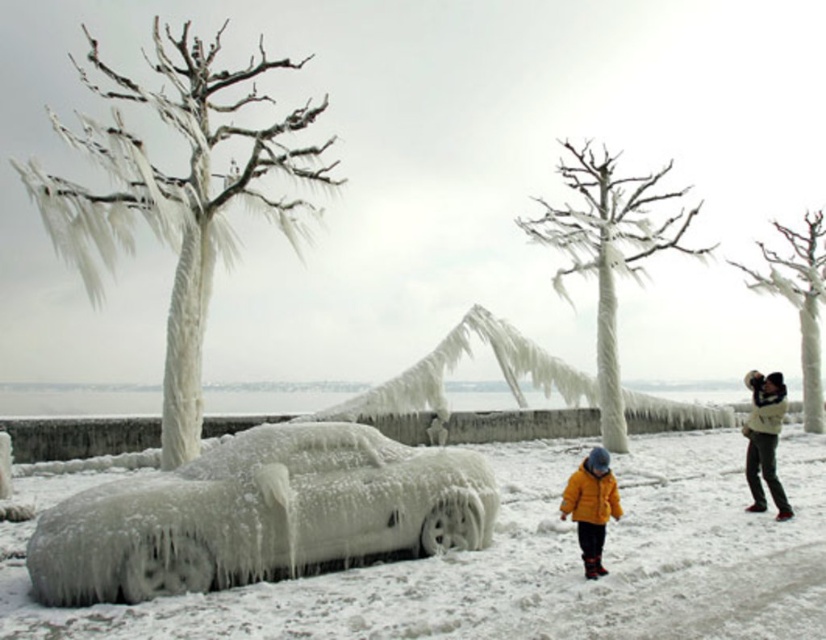
Looking at this image, does white frosty tree at center lie behind white frosty tree at upper right?

No, it is in front of white frosty tree at upper right.

Identify the location of white frosty tree at center. (610, 250).

At what (x,y) coordinates should I click in order to perform the action: click on white frosty tree at center. Please return your answer as a coordinate pair (x, y). Looking at the image, I should click on (610, 250).

Does white woolen sweater at upper right have a lesser width compared to white fleece jacket at right?

Correct, white woolen sweater at upper right's width is less than white fleece jacket at right's.

In order to click on white woolen sweater at upper right in this screenshot , I will do `click(763, 440)`.

Between white frosty tree at center and white fleece jacket at right, which one is positioned higher?

white frosty tree at center is higher up.

Is white frosty tree at center wider than white fleece jacket at right?

Incorrect, white frosty tree at center's width does not surpass white fleece jacket at right's.

Find the location of a particular element. white frosty tree at center is located at coordinates (610, 250).

The height and width of the screenshot is (640, 826). Find the location of `white frosty tree at center`. white frosty tree at center is located at coordinates (610, 250).